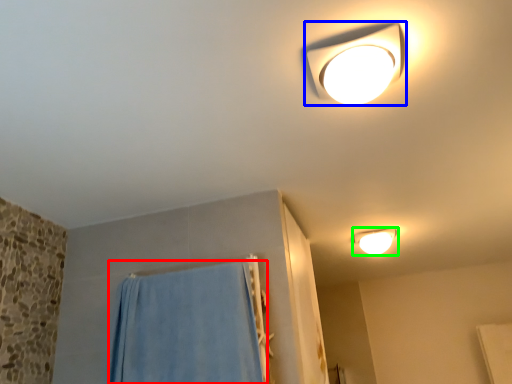
Question: Which is farther away from curtain (highlighted by a red box)? lamp (highlighted by a blue box) or lamp (highlighted by a green box)?

Choices:
 (A) lamp
 (B) lamp

Answer: (B)